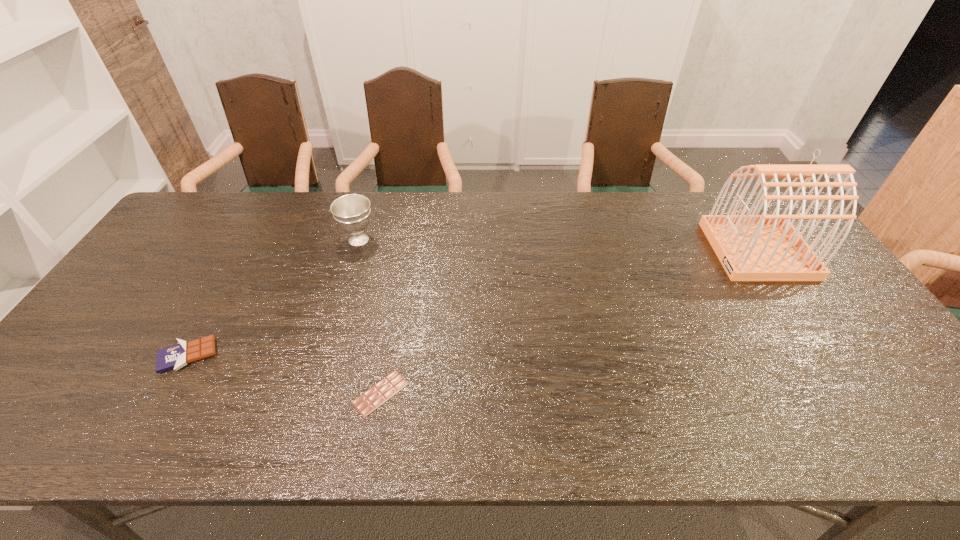
The image size is (960, 540). Identify the location of birdcage. (752, 247).

You are a GUI agent. You are given a task and a screenshot of the screen. Output one action in this format:
    pyautogui.click(x=<x>, y=<y>)
    Task: Click on the rightmost object
    Image resolution: width=960 pixels, height=540 pixels.
    Given the screenshot: What is the action you would take?
    pyautogui.click(x=752, y=247)

Identify the location of the third shortest object. (352, 212).

Locate an element on the screen. The image size is (960, 540). chalice is located at coordinates (352, 212).

You are a GUI agent. You are given a task and a screenshot of the screen. Output one action in this format:
    pyautogui.click(x=<x>, y=<y>)
    Task: Click on the left chocolate bar
    The width and height of the screenshot is (960, 540).
    Given the screenshot: What is the action you would take?
    pyautogui.click(x=176, y=356)

Locate an element on the screen. The width and height of the screenshot is (960, 540). the second shortest object is located at coordinates (176, 356).

Identify the location of the right chocolate bar. The image size is (960, 540). (366, 403).

The width and height of the screenshot is (960, 540). Find the location of `the third object from left to right`. the third object from left to right is located at coordinates (366, 403).

The width and height of the screenshot is (960, 540). Identify the location of free space located with an open door on the tallest object. (598, 250).

This screenshot has height=540, width=960. What are the coordinates of `vacant space located with an open door on the tallest object` in the screenshot? It's located at (643, 250).